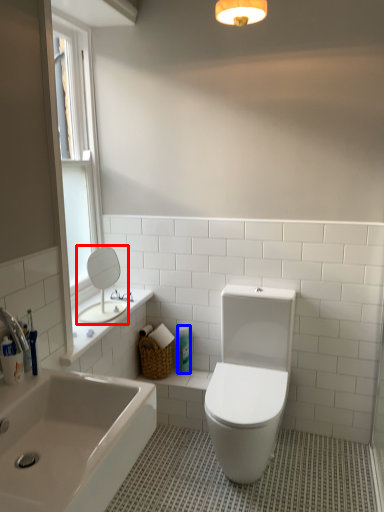
Question: Among these objects, which one is nearest to the camera, mirror (highlighted by a red box) or toiletry (highlighted by a blue box)?

Choices:
 (A) mirror
 (B) toiletry

Answer: (A)